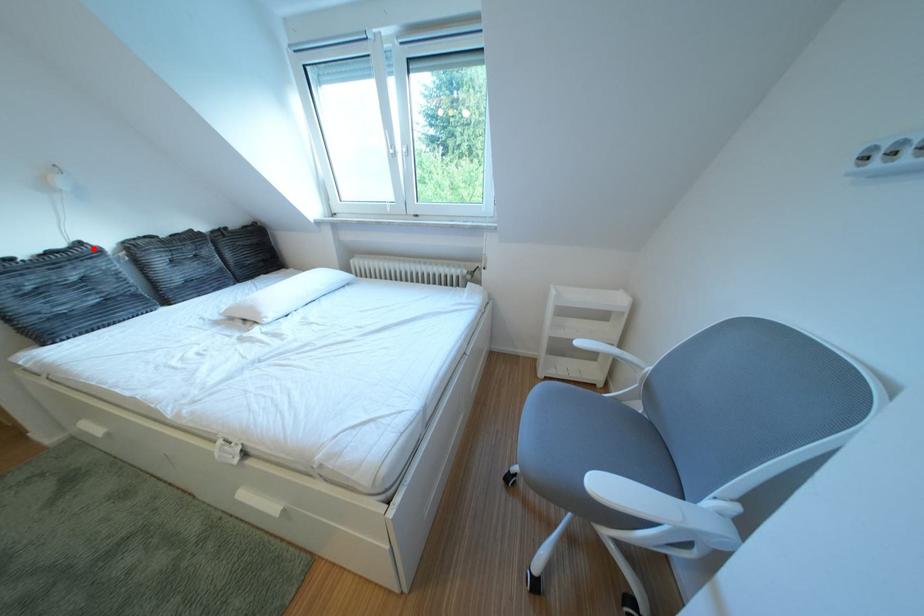
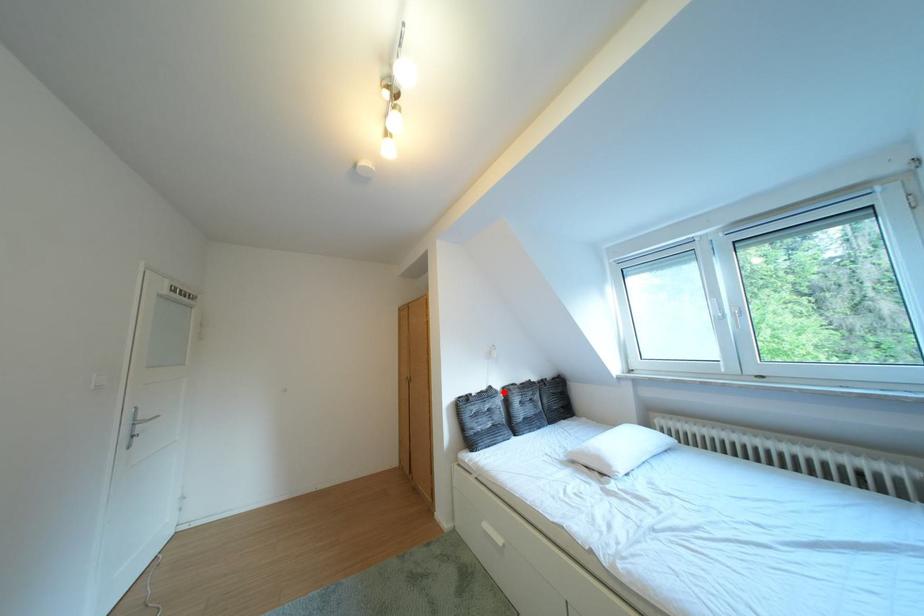
I am providing you with two images of the same scene from different viewpoints. A red point is marked on the first image and another point is marked on the second image. Do the highlighted points in image1 and image2 indicate the same real-world spot?

Yes